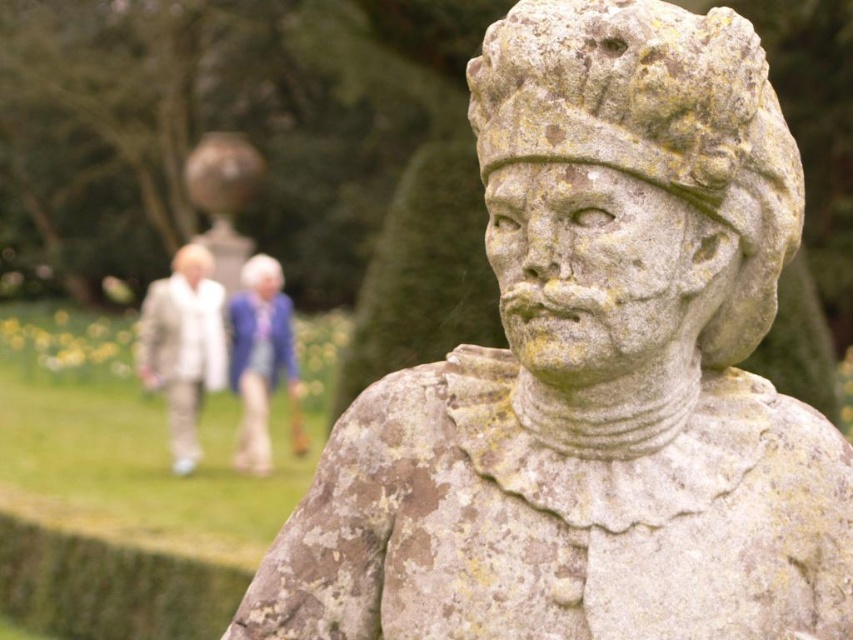
The width and height of the screenshot is (853, 640). What do you see at coordinates (183, 346) in the screenshot? I see `matte stone statue at center` at bounding box center [183, 346].

Does matte stone statue at center appear on the left side of blue fabric jacket at center?

Yes, matte stone statue at center is to the left of blue fabric jacket at center.

Locate an element on the screen. matte stone statue at center is located at coordinates (183, 346).

Does weathered stone head at center have a smaller size compared to matte stone head at center?

No.

Is weathered stone head at center to the right of matte stone head at center from the viewer's perspective?

Correct, you'll find weathered stone head at center to the right of matte stone head at center.

Between point (747, 320) and point (254, 291), which one is positioned behind?

The point (254, 291) is more distant.

Locate an element on the screen. Image resolution: width=853 pixels, height=640 pixels. weathered stone head at center is located at coordinates (653, 125).

Can you confirm if weathered stone head at center is shorter than matte white head at center?

No, weathered stone head at center is not shorter than matte white head at center.

Is point (604, 80) farther from camera compared to point (181, 264)?

No, (604, 80) is closer to viewer.

Is point (531, 33) behind point (202, 252)?

No.

Image resolution: width=853 pixels, height=640 pixels. Find the location of `weathered stone head at center`. weathered stone head at center is located at coordinates (653, 125).